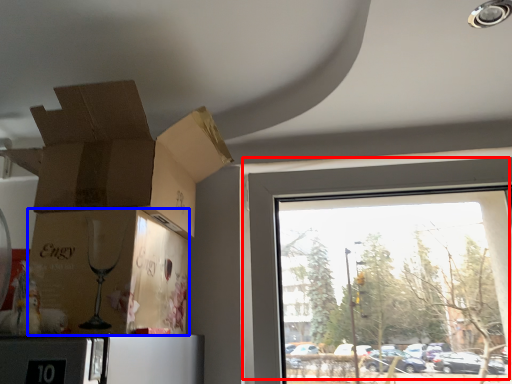
Question: Which of the following is the closest to the observer, window (highlighted by a red box) or cardboard box (highlighted by a blue box)?

Choices:
 (A) window
 (B) cardboard box

Answer: (B)